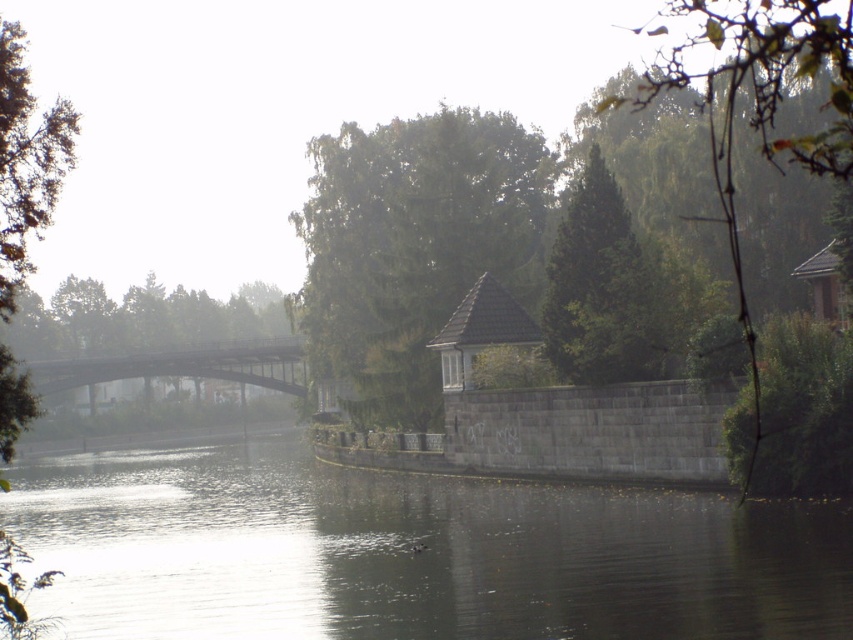
Locate an element on the screen. green matte tree at left is located at coordinates (154, 333).

The width and height of the screenshot is (853, 640). What do you see at coordinates (154, 333) in the screenshot?
I see `green matte tree at left` at bounding box center [154, 333].

This screenshot has width=853, height=640. Identify the location of green matte tree at left. (154, 333).

Is point (49, 561) positioned behind point (231, 380)?

No, (49, 561) is in front of (231, 380).

Measure the distance between dark reflective water at center and green matte tree at left.

A distance of 64.06 meters exists between dark reflective water at center and green matte tree at left.

Who is more distant from viewer, (166,545) or (146,314)?

The point (146,314) is behind.

Where is `dark reflective water at center`? dark reflective water at center is located at coordinates (410, 554).

Does green textured tree at center lie behind green leafy tree at left?

Yes, it is.

Can you confirm if green textured tree at center is taller than green leafy tree at left?

Yes, green textured tree at center is taller than green leafy tree at left.

Is point (555, 320) positioned before point (7, 88)?

No, (555, 320) is further to viewer.

Where is `green textured tree at center`? The image size is (853, 640). green textured tree at center is located at coordinates tap(601, 289).